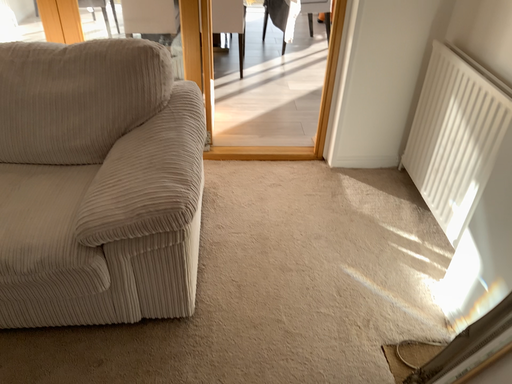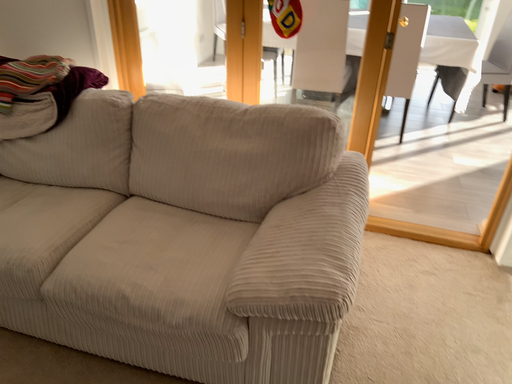
Question: Which way did the camera rotate in the video?

Choices:
 (A) rotated downward
 (B) rotated upward

Answer: (B)